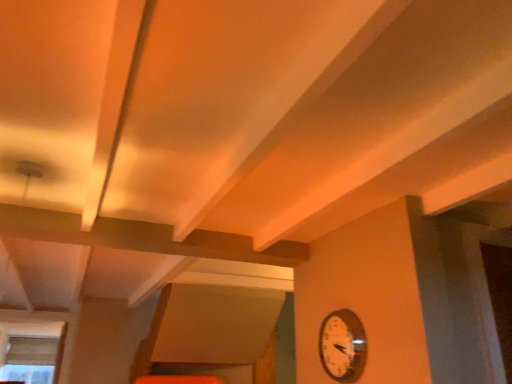
What do you see at coordinates (343, 346) in the screenshot? I see `metallic silver clock at lower right` at bounding box center [343, 346].

I want to click on metallic silver clock at lower right, so click(343, 346).

Find the location of a particular element. The width and height of the screenshot is (512, 384). clear glass window at lower left is located at coordinates (33, 358).

What do you see at coordinates (33, 358) in the screenshot? The height and width of the screenshot is (384, 512). I see `clear glass window at lower left` at bounding box center [33, 358].

The height and width of the screenshot is (384, 512). Find the location of `metallic silver clock at lower right`. metallic silver clock at lower right is located at coordinates (343, 346).

Is metallic silver clock at lower right at the right side of clear glass window at lower left?

Correct, you'll find metallic silver clock at lower right to the right of clear glass window at lower left.

In the scene shown: In the image, is metallic silver clock at lower right positioned in front of or behind clear glass window at lower left?

Visually, metallic silver clock at lower right is located in front of clear glass window at lower left.

Is point (329, 321) positioned before point (39, 378)?

Yes.

From the image's perspective, who appears lower, metallic silver clock at lower right or clear glass window at lower left?

clear glass window at lower left, from the image's perspective.

From a real-world perspective, which object rests below the other?

In real-world perspective, metallic silver clock at lower right is lower.

Which of these two, metallic silver clock at lower right or clear glass window at lower left, is wider?

With larger width is clear glass window at lower left.

Considering the sizes of objects metallic silver clock at lower right and clear glass window at lower left in the image provided, who is taller, metallic silver clock at lower right or clear glass window at lower left?

clear glass window at lower left.

Can you confirm if metallic silver clock at lower right is smaller than clear glass window at lower left?

Correct, metallic silver clock at lower right occupies less space than clear glass window at lower left.

Choose the correct answer: Is metallic silver clock at lower right inside clear glass window at lower left or outside it?

metallic silver clock at lower right is not enclosed by clear glass window at lower left.

Is metallic silver clock at lower right far from clear glass window at lower left?

Yes.

Is metallic silver clock at lower right facing away from clear glass window at lower left?

metallic silver clock at lower right is not turned away from clear glass window at lower left.

How different are the orientations of metallic silver clock at lower right and clear glass window at lower left in degrees?

They differ by 86.2 degrees in their facing directions.

This screenshot has width=512, height=384. I want to click on wall clock in front of the clear glass window at lower left, so click(x=343, y=346).

Is clear glass window at lower left to the right of metallic silver clock at lower right from the viewer's perspective?

No.

Is clear glass window at lower left positioned before metallic silver clock at lower right?

No, it is behind metallic silver clock at lower right.

Is point (5, 359) closer to camera compared to point (323, 323)?

No.

From the image's perspective, is clear glass window at lower left over metallic silver clock at lower right?

No, from the image's perspective, clear glass window at lower left is not above metallic silver clock at lower right.

From a real-world perspective, is clear glass window at lower left physically located above or below metallic silver clock at lower right?

In terms of real-world spatial position, clear glass window at lower left is above metallic silver clock at lower right.

Which of these two, clear glass window at lower left or metallic silver clock at lower right, is wider?

clear glass window at lower left.

From their relative heights in the image, would you say clear glass window at lower left is taller or shorter than metallic silver clock at lower right?

Clearly, clear glass window at lower left is taller compared to metallic silver clock at lower right.

Is clear glass window at lower left bigger than metallic silver clock at lower right?

Yes.

Is clear glass window at lower left completely or partially outside of metallic silver clock at lower right?

Indeed, clear glass window at lower left is completely outside metallic silver clock at lower right.

Are clear glass window at lower left and metallic silver clock at lower right making contact?

No, clear glass window at lower left is not in contact with metallic silver clock at lower right.

Is clear glass window at lower left facing away from metallic silver clock at lower right?

No, clear glass window at lower left is not facing the opposite direction of metallic silver clock at lower right.

How much distance is there between clear glass window at lower left and metallic silver clock at lower right?

clear glass window at lower left and metallic silver clock at lower right are 3.59 meters apart.

Identify the location of wall clock that appears on the right of clear glass window at lower left. Image resolution: width=512 pixels, height=384 pixels. (343, 346).

Locate an element on the screen. wall clock lying in front of the clear glass window at lower left is located at coordinates (343, 346).

At what (x,y) coordinates should I click in order to perform the action: click on window to the left of metallic silver clock at lower right. Please return your answer as a coordinate pair (x, y). Looking at the image, I should click on (33, 358).